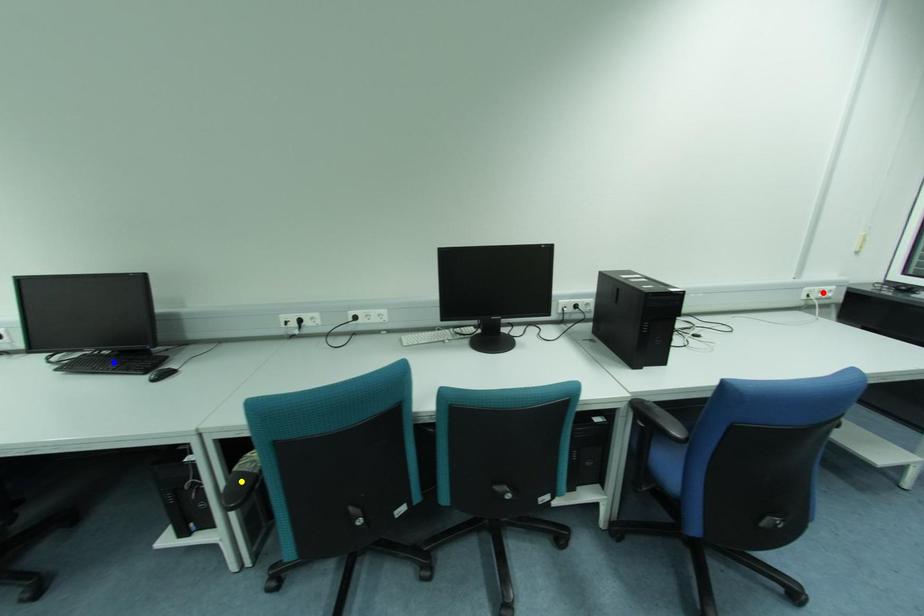
Order these from nearest to farthest:
red point, blue point, yellow point

yellow point → blue point → red point